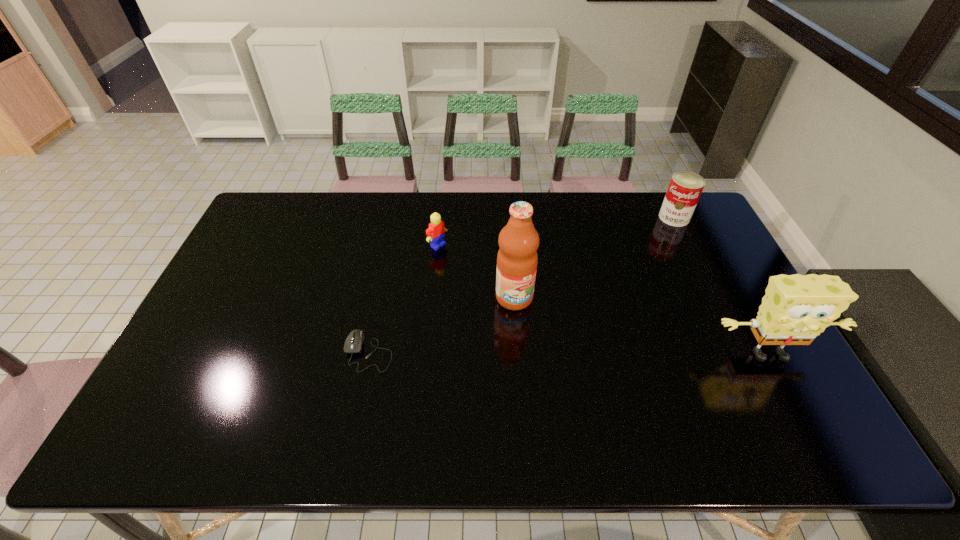
Identify the location of the shortest object. The height and width of the screenshot is (540, 960). (353, 344).

You are a GUI agent. You are given a task and a screenshot of the screen. Output one action in this format:
    pyautogui.click(x=<x>, y=<y>)
    Task: Click on the leftmost object
    
    Given the screenshot: What is the action you would take?
    pyautogui.click(x=353, y=344)

Locate an element on the screen. The height and width of the screenshot is (540, 960). sponge is located at coordinates (796, 308).

Image resolution: width=960 pixels, height=540 pixels. I want to click on the farthest object, so click(685, 188).

This screenshot has width=960, height=540. Identify the location of the third shortest object. (685, 188).

Locate an element on the screen. Image resolution: width=960 pixels, height=540 pixels. the fourth object from right to left is located at coordinates (435, 233).

The height and width of the screenshot is (540, 960). Find the location of `Lego`. Lego is located at coordinates (435, 233).

I want to click on fruit juice, so click(x=517, y=258).

Identify the location of the third farthest object. (517, 258).

In order to click on vacant region located 0.100m on the right of the leftmost object in this screenshot , I will do `click(430, 351)`.